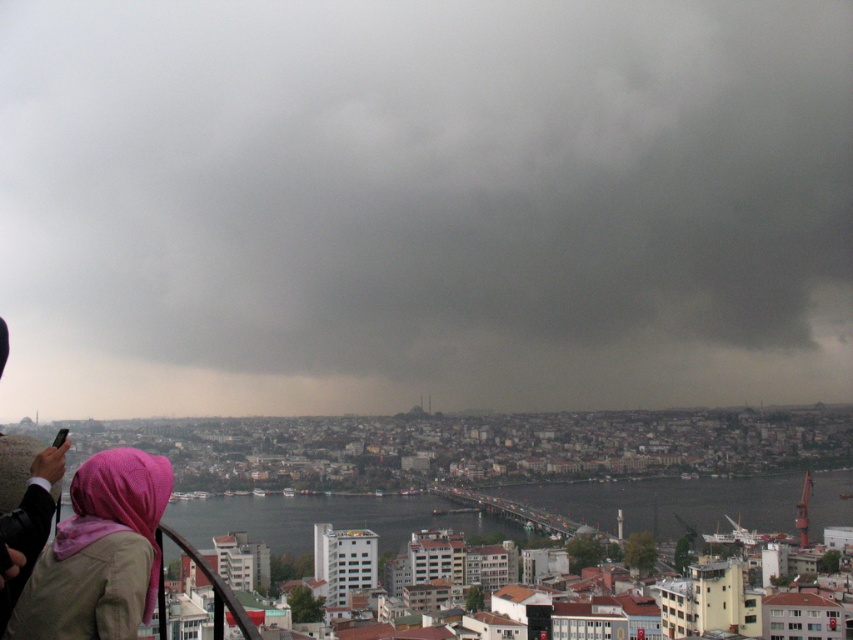
Question: Which point is closer to the camera?

Choices:
 (A) (141, 310)
 (B) (128, 627)

Answer: (B)

Question: Among these objects, which one is farthest from the camera?

Choices:
 (A) pink fabric headscarf at lower left
 (B) dark gray cloud at upper center

Answer: (B)

Question: Does dark gray cloud at upper center appear on the left side of pink fabric headscarf at lower left?

Choices:
 (A) no
 (B) yes

Answer: (A)

Question: Can you confirm if dark gray cloud at upper center is bigger than pink fabric headscarf at lower left?

Choices:
 (A) yes
 (B) no

Answer: (A)

Question: Is dark gray cloud at upper center further to the viewer compared to pink fabric headscarf at lower left?

Choices:
 (A) no
 (B) yes

Answer: (B)